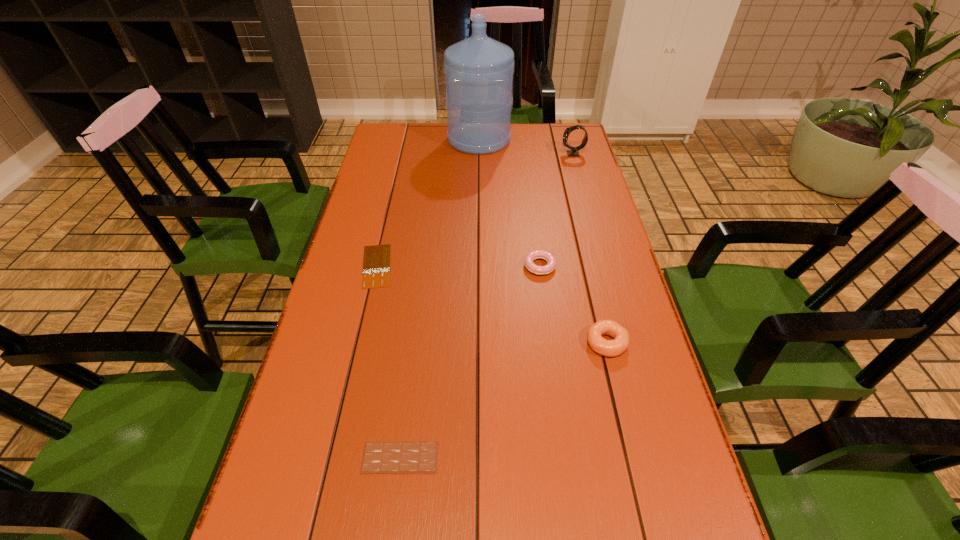
Identify the location of vacant space that satisfies the following two spatial constraints: 1. on the front side of the third shortest object; 2. on the left side of the second nearest object. The height and width of the screenshot is (540, 960). (550, 343).